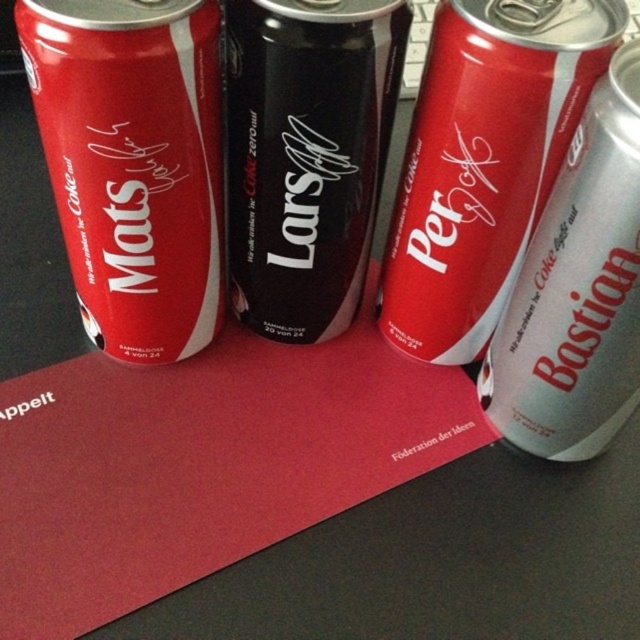
Does matte black can at left have a greater width compared to silver metallic can at right?

Indeed, matte black can at left has a greater width compared to silver metallic can at right.

Where is `matte black can at left`? matte black can at left is located at coordinates (132, 163).

Is matte black can at left closer to the viewer compared to matte silver can at center?

Yes, it is.

Who is taller, matte black can at left or matte silver can at center?

matte silver can at center is taller.

Is point (147, 212) less distant than point (589, 64)?

No, it is behind (589, 64).

Find the location of a particular element. This screenshot has width=640, height=640. matte black can at left is located at coordinates (x=132, y=163).

Who is shorter, black matte can at center or silver metallic can at right?

black matte can at center

Does point (268, 196) lie in front of point (588, 212)?

No, it is not.

The image size is (640, 640). Identify the location of black matte can at center. (307, 154).